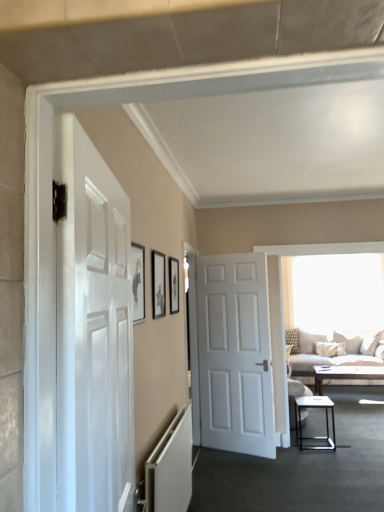
Question: Considering the positions of beige fabric couch at right and transparent glass window at upper center in the image, is beige fabric couch at right bigger or smaller than transparent glass window at upper center?

Choices:
 (A) big
 (B) small

Answer: (A)

Question: Considering their positions, is beige fabric couch at right located in front of or behind transparent glass window at upper center?

Choices:
 (A) front
 (B) behind

Answer: (A)

Question: Which object is positioned closest to the white matte radiator at lower left?

Choices:
 (A) beige fabric couch at right
 (B) white matte door at center, placed as the 1th door when sorted from back to front
 (C) matte black picture frame at center, which appears as the second picture frame when viewed from the right
 (D) matte black picture frame at upper center, which appears as the 3th picture frame when viewed from the right
 (E) white glossy door at left, the 2th door when ordered from right to left

Answer: (C)

Question: Based on their relative distances, which object is nearer to the light brown wooden coffee table at center?

Choices:
 (A) matte black picture frame at center, the second picture frame in the front-to-back sequence
 (B) black metal table at lower right
 (C) white matte radiator at lower left
 (D) matte black picture frame at upper center, the third picture frame from the left
 (E) white matte door at center, which is the 2th door from left to right

Answer: (B)